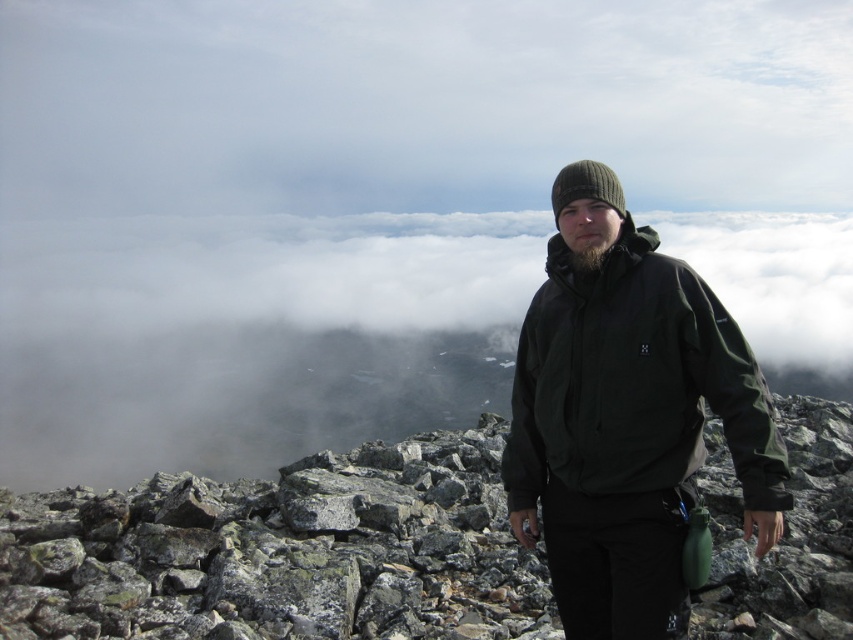
You are a hiker trying to navigate between two points marked on a map. The first point is at coordinate point [47,496] and the second is at point [593,211]. Given that you are standing at the first point, which direction should you move to reach the second point?

Since point [47,496] is closer to you than point [593,211], you should move away from your current position towards the second point which is further back in the scene.

You are a hiker who wants to place a small flag on the highest point of the gray rock pile at center. Since you are standing on the dark green softshell jacket at center, can you reach down to place the flag without moving your feet?

The gray rock pile at center is located below the dark green softshell jacket at center, so yes, you can reach down to place the flag on the gray rock pile at center since it is beneath your current position.